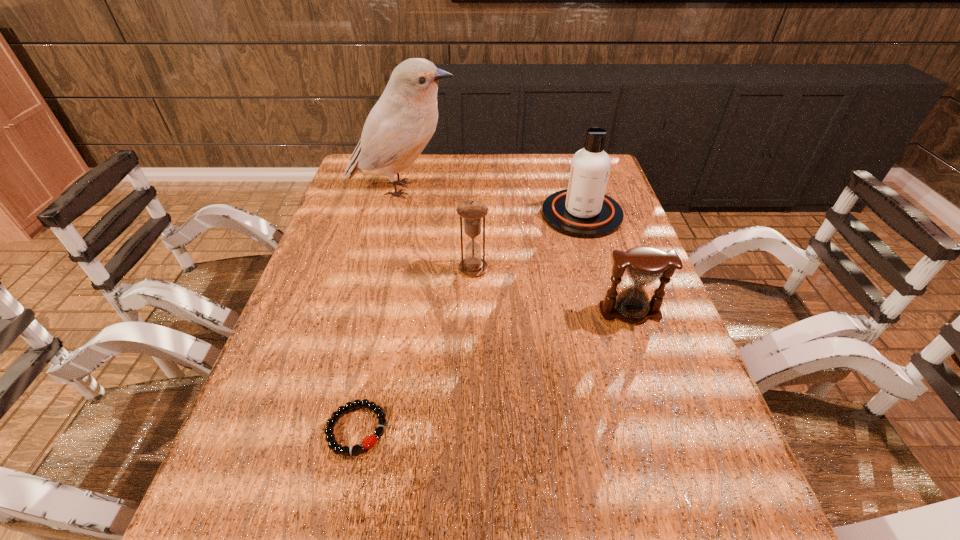
Identify the location of free space between the parakeet and the bracelet. Image resolution: width=960 pixels, height=540 pixels. (379, 309).

Locate an element on the screen. This screenshot has height=540, width=960. free space between the cleansing agent and the parakeet is located at coordinates (492, 202).

The height and width of the screenshot is (540, 960). I want to click on object that ranks as the closest to the shortest object, so click(472, 211).

Locate an element on the screen. The height and width of the screenshot is (540, 960). the third closest object relative to the parakeet is located at coordinates (644, 265).

This screenshot has width=960, height=540. I want to click on vacant space that satisfies the following two spatial constraints: 1. on the face of the nearer hourglass; 2. on the right side of the tallest object, so click(372, 312).

Identify the location of free space that satisfies the following two spatial constraints: 1. on the back side of the nearest object; 2. on the face of the tallest object. coord(409,190).

Where is `blank area in the image that satisfies the following two spatial constraints: 1. on the back side of the farther hourglass; 2. on the face of the tallest object`? The image size is (960, 540). blank area in the image that satisfies the following two spatial constraints: 1. on the back side of the farther hourglass; 2. on the face of the tallest object is located at coordinates click(x=474, y=190).

At what (x,y) coordinates should I click in order to perform the action: click on blank space that satisfies the following two spatial constraints: 1. on the face of the nearest object; 2. on the right side of the parakeet. Please return your answer as a coordinate pair (x, y). This screenshot has width=960, height=540. Looking at the image, I should click on (345, 429).

Image resolution: width=960 pixels, height=540 pixels. I want to click on free space in the image that satisfies the following two spatial constraints: 1. on the face of the nearer hourglass; 2. on the right side of the parakeet, so click(x=372, y=312).

Find the location of a particular element. The width and height of the screenshot is (960, 540). vacant region that satisfies the following two spatial constraints: 1. on the face of the parakeet; 2. on the back side of the shortest object is located at coordinates (345, 429).